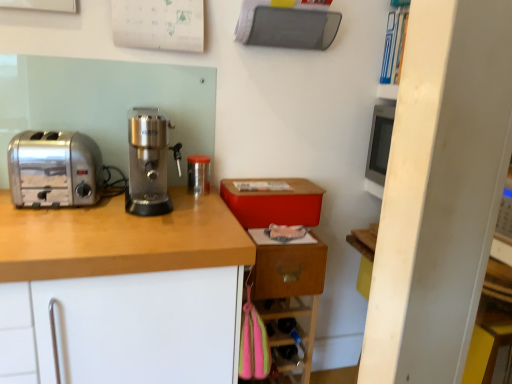
Question: Is satin silver coffee grinder at center positioned before wooden drawer at lower right?

Choices:
 (A) yes
 (B) no

Answer: (A)

Question: From the image's perspective, is satin silver coffee grinder at center below wooden drawer at lower right?

Choices:
 (A) yes
 (B) no

Answer: (B)

Question: From a real-world perspective, is satin silver coffee grinder at center over wooden drawer at lower right?

Choices:
 (A) yes
 (B) no

Answer: (A)

Question: Is satin silver coffee grinder at center wider than wooden drawer at lower right?

Choices:
 (A) yes
 (B) no

Answer: (A)

Question: Does satin silver coffee grinder at center come behind wooden drawer at lower right?

Choices:
 (A) no
 (B) yes

Answer: (A)

Question: From the image's perspective, is satin silver toaster at left positioned above or below satin silver coffee grinder at center?

Choices:
 (A) above
 (B) below

Answer: (B)

Question: Is satin silver toaster at left in front of or behind satin silver coffee grinder at center in the image?

Choices:
 (A) behind
 (B) front

Answer: (A)

Question: Considering the positions of point (53, 140) and point (162, 170), is point (53, 140) closer or farther from the camera than point (162, 170)?

Choices:
 (A) closer
 (B) farther

Answer: (A)

Question: Do you think satin silver toaster at left is within satin silver coffee grinder at center, or outside of it?

Choices:
 (A) outside
 (B) inside

Answer: (A)

Question: Is point (154, 112) closer or farther from the camera than point (199, 231)?

Choices:
 (A) farther
 (B) closer

Answer: (A)

Question: From a real-world perspective, is satin silver coffee grinder at center physically located above or below wooden at left?

Choices:
 (A) above
 (B) below

Answer: (A)

Question: Considering the positions of satin silver coffee grinder at center and wooden at left in the image, is satin silver coffee grinder at center wider or thinner than wooden at left?

Choices:
 (A) wide
 (B) thin

Answer: (B)

Question: Would you say satin silver coffee grinder at center is inside or outside wooden at left?

Choices:
 (A) outside
 (B) inside

Answer: (A)

Question: From the image's perspective, is wooden drawer at lower right positioned above or below transparent plastic container at center?

Choices:
 (A) below
 (B) above

Answer: (A)

Question: From their relative heights in the image, would you say wooden drawer at lower right is taller or shorter than transparent plastic container at center?

Choices:
 (A) tall
 (B) short

Answer: (A)